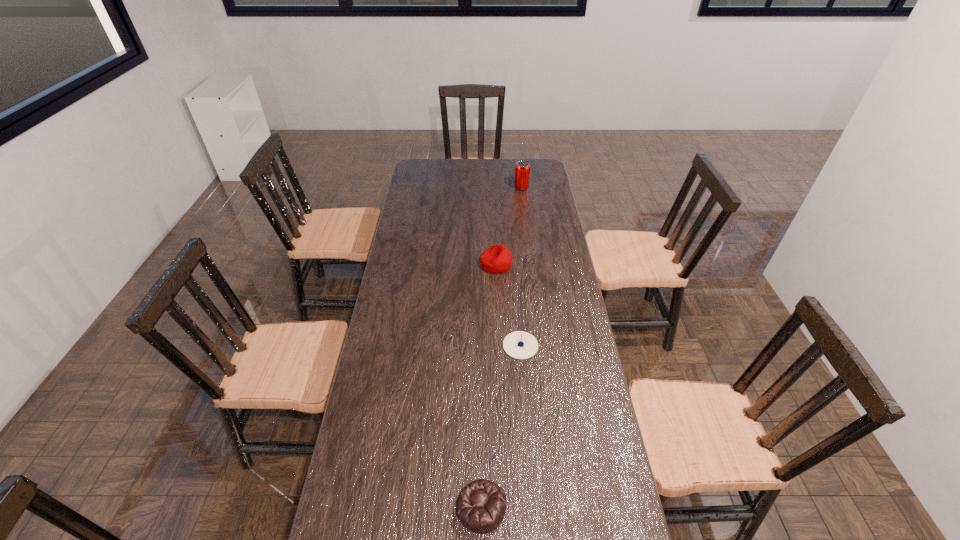
You are a GUI agent. You are given a task and a screenshot of the screen. Output one action in this format:
    pyautogui.click(x=<x>, y=<y>)
    Task: Click on the free spot that satisfies the following two spatial constraints: 1. on the seat area of the third nearest object; 2. on the front side of the nearer beanbag
    The width and height of the screenshot is (960, 540).
    Given the screenshot: What is the action you would take?
    pyautogui.click(x=507, y=507)

Where is `vacant space that satisfies the following two spatial constraints: 1. on the seat area of the second tallest object; 2. on the right side of the third farthest object`? The width and height of the screenshot is (960, 540). vacant space that satisfies the following two spatial constraints: 1. on the seat area of the second tallest object; 2. on the right side of the third farthest object is located at coordinates (500, 346).

Where is `free space that satisfies the following two spatial constraints: 1. on the back side of the compass; 2. on the seat area of the third nearest object`? free space that satisfies the following two spatial constraints: 1. on the back side of the compass; 2. on the seat area of the third nearest object is located at coordinates (514, 264).